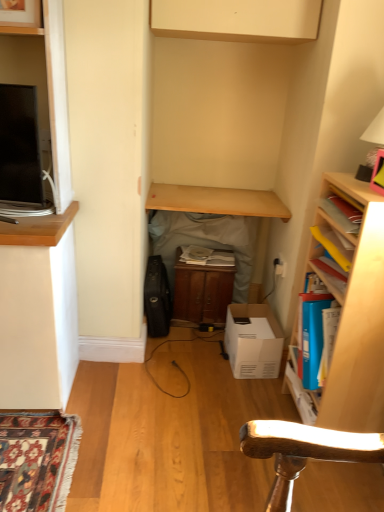
Question: Considering the relative sizes of matte white cabinet at upper center and wooden cabinet at center in the image provided, is matte white cabinet at upper center thinner than wooden cabinet at center?

Choices:
 (A) yes
 (B) no

Answer: (B)

Question: Can you confirm if matte white cabinet at upper center is shorter than wooden cabinet at center?

Choices:
 (A) no
 (B) yes

Answer: (B)

Question: From a real-world perspective, is matte white cabinet at upper center below wooden cabinet at center?

Choices:
 (A) no
 (B) yes

Answer: (A)

Question: From the image's perspective, is matte white cabinet at upper center located above wooden cabinet at center?

Choices:
 (A) no
 (B) yes

Answer: (B)

Question: Is matte white cabinet at upper center next to wooden cabinet at center and touching it?

Choices:
 (A) yes
 (B) no

Answer: (B)

Question: Is matte white cabinet at upper center bigger than wooden cabinet at center?

Choices:
 (A) no
 (B) yes

Answer: (B)

Question: Is wooden cabinet at center, placed as the 1th table when sorted from bottom to top, directly adjacent to wooden bookshelf at right?

Choices:
 (A) yes
 (B) no

Answer: (B)

Question: Is wooden cabinet at center, marked as the 2th table in a top-to-bottom arrangement, wider than wooden bookshelf at right?

Choices:
 (A) yes
 (B) no

Answer: (B)

Question: Is wooden cabinet at center, marked as the 2th table in a top-to-bottom arrangement, outside wooden bookshelf at right?

Choices:
 (A) no
 (B) yes

Answer: (B)

Question: Is wooden cabinet at center, marked as the 2th table in a top-to-bottom arrangement, shorter than wooden bookshelf at right?

Choices:
 (A) no
 (B) yes

Answer: (B)

Question: Are wooden cabinet at center, placed as the 1th table when sorted from bottom to top, and wooden bookshelf at right located far from each other?

Choices:
 (A) yes
 (B) no

Answer: (B)

Question: From the image's perspective, is wooden cabinet at center, marked as the 2th table in a top-to-bottom arrangement, on wooden bookshelf at right?

Choices:
 (A) yes
 (B) no

Answer: (A)

Question: From the image's perspective, is light wood table at center, the first table viewed from the top, located beneath wooden cabinet at center, marked as the 2th table in a top-to-bottom arrangement?

Choices:
 (A) yes
 (B) no

Answer: (B)